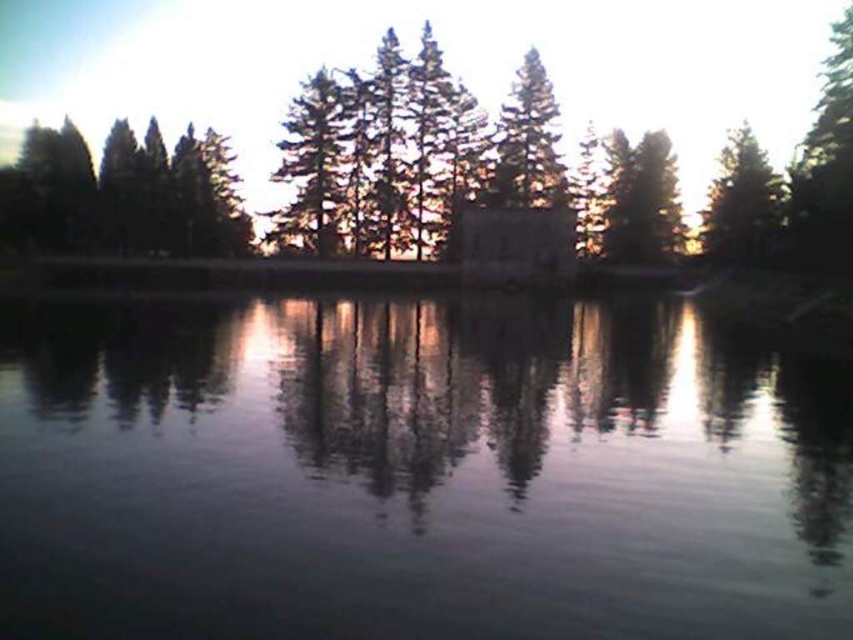
Question: Which object is the closest to the green matte tree at upper right?

Choices:
 (A) transparent liquid water at center
 (B) green textured tree at right
 (C) green matte trees at left

Answer: (B)

Question: Can you confirm if green matte trees at left is wider than green matte tree at upper right?

Choices:
 (A) no
 (B) yes

Answer: (B)

Question: Is the position of green textured tree at right less distant than that of green matte tree at upper right?

Choices:
 (A) yes
 (B) no

Answer: (A)

Question: Can you confirm if transparent liquid water at center is bigger than green matte trees at left?

Choices:
 (A) no
 (B) yes

Answer: (A)

Question: Which is farther from the green matte trees at left?

Choices:
 (A) transparent liquid water at center
 (B) green textured tree at right

Answer: (B)

Question: Which object appears farthest from the camera in this image?

Choices:
 (A) green textured tree at right
 (B) green matte tree at upper right
 (C) transparent liquid water at center
 (D) green matte trees at left

Answer: (D)